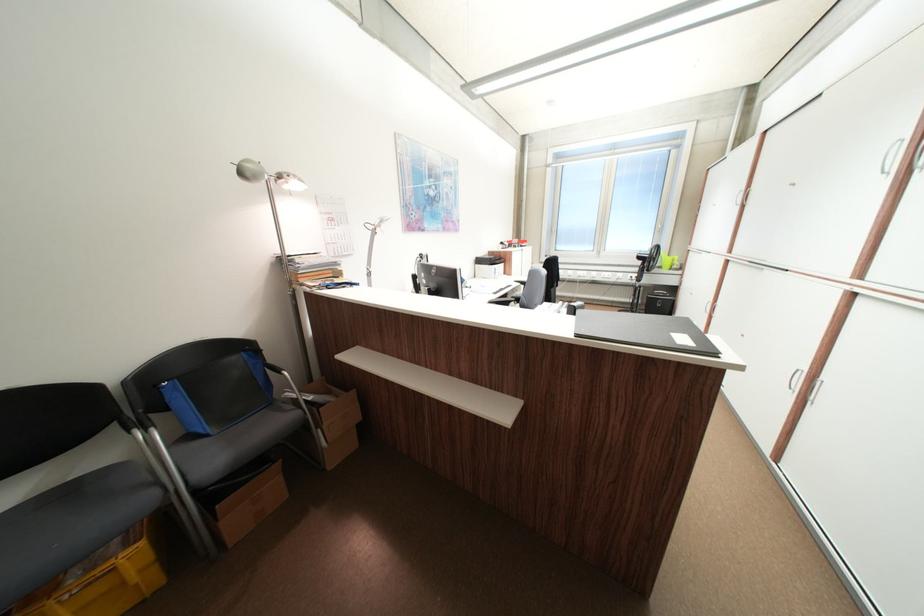
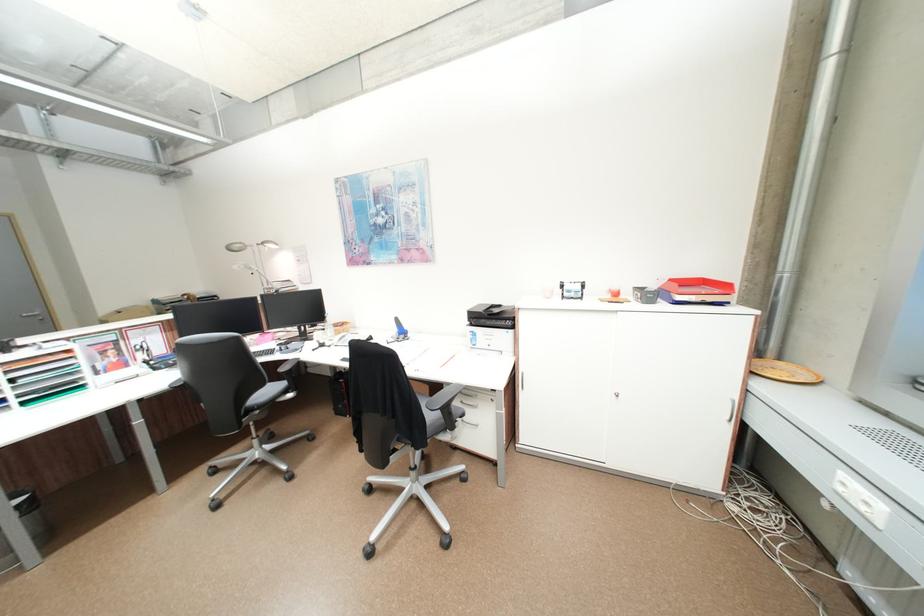
Where in the second image is the point corresponding to the point at 301,185 from the first image?

(281, 246)